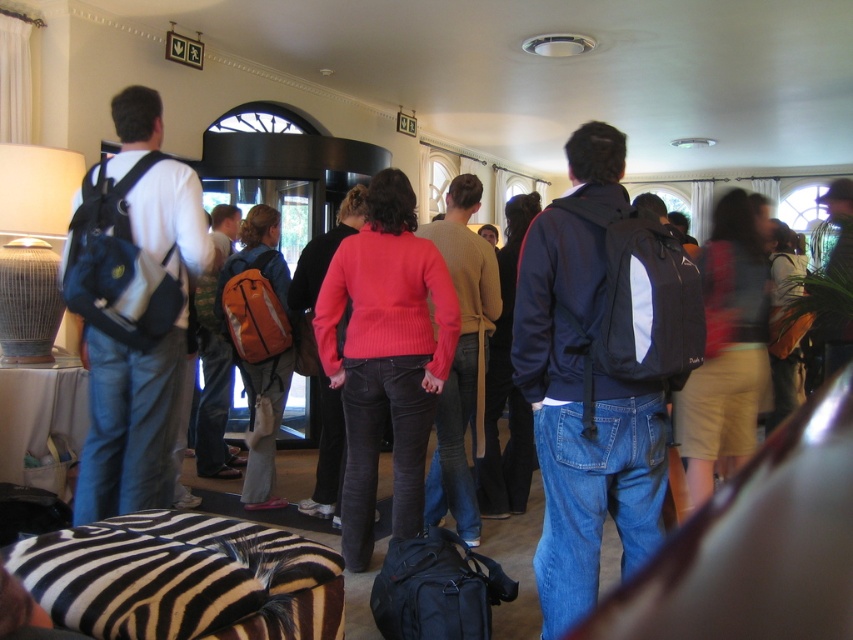
You are standing in the room and want to take a photo of both the point at coordinates (107, 180) and the point at coordinates (343, 508). Which point should you focus on first to ensure both are in focus?

You should focus on the point at coordinates (107, 180) first because it is closer to the camera than the point at coordinates (343, 508). This ensures that both points will be within the depth of field when taking the photo.

You are standing in the room and want to move from the matte black backpack at left to the matte blue jacket at center. Which direction should you move to reach it?

The matte blue jacket at center is to the right of the matte black backpack at left, so you should move to the right to reach it.

You are standing at the entrance of the room and see the matte black backpack at left. Can you determine its exact position relative to the entrance?

The matte black backpack at left is located at point 0.483 on the horizontal axis and 0.157 on the vertical axis relative to the entrance.